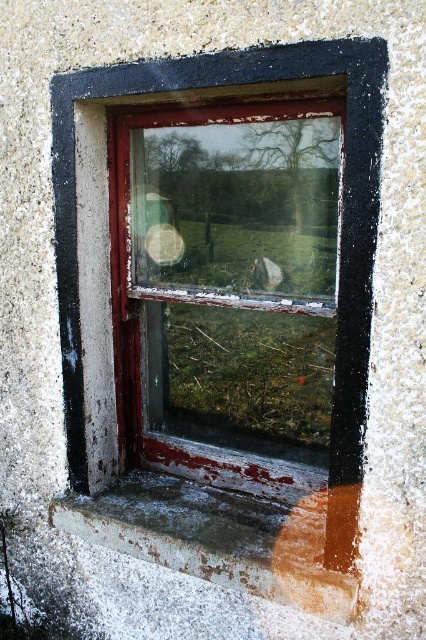
You are an interior designer assessing the space. You have a decorative wooden panel that is exactly the same size as the brown wood at lower right. If you want to place this panel next to the rusty glass window at center, will it fit without overlapping?

The rusty glass window at center might be wider than brown wood at lower right, so there is a possibility that the panel will not fit. It is recommended to measure the space first before placing the panel.

You are a painter who wants to place a small potted plant on the rusty concrete window sill at lower center and the brown wood at lower right. Which surface can accommodate the plant better based on their sizes?

The rusty concrete window sill at lower center is larger in size than the brown wood at lower right, so it can accommodate the plant better.

You are a window cleaner with a 12 inch long cleaning tool. You need to clean the rusty glass window at center and the rusty concrete window sill at lower center. Can your tool reach both areas if you stand at the same spot?

The rusty glass window at center and rusty concrete window sill at lower center are 16.03 inches apart. Since your tool is only 12 inches long, it cannot reach both areas simultaneously from the same position.